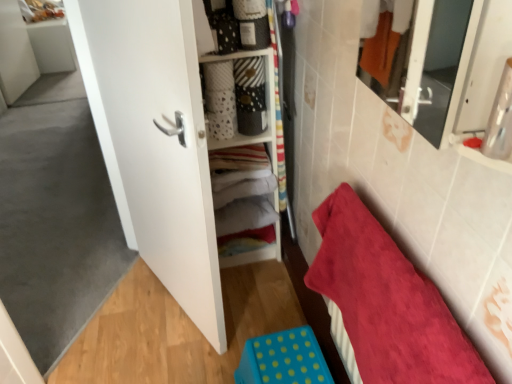
You are a GUI agent. You are given a task and a screenshot of the screen. Output one action in this format:
    pyautogui.click(x=<x>, y=<y>)
    Task: Click on the free space above red plush towel at lower right (from a real-world perspective)
    The width and height of the screenshot is (512, 384).
    Given the screenshot: What is the action you would take?
    (x=398, y=258)